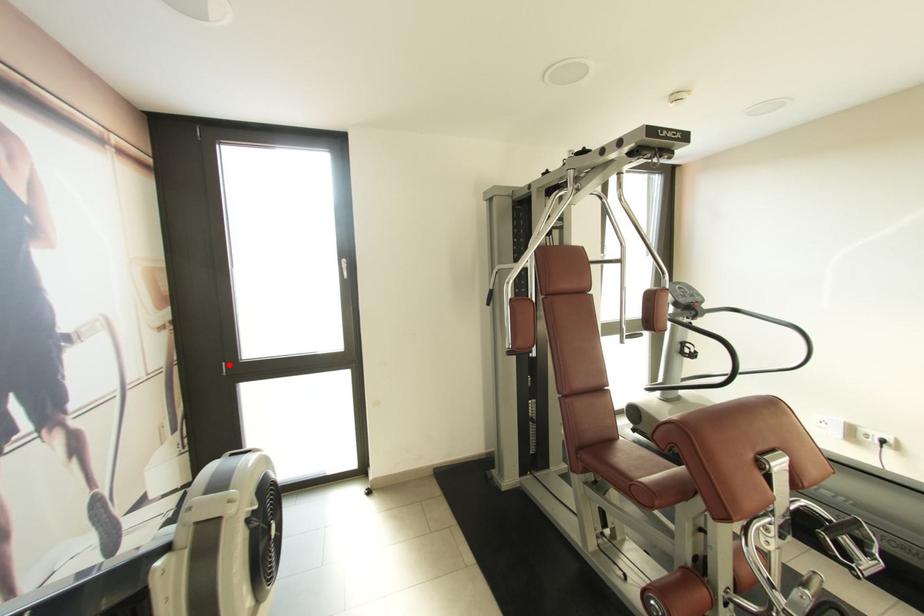
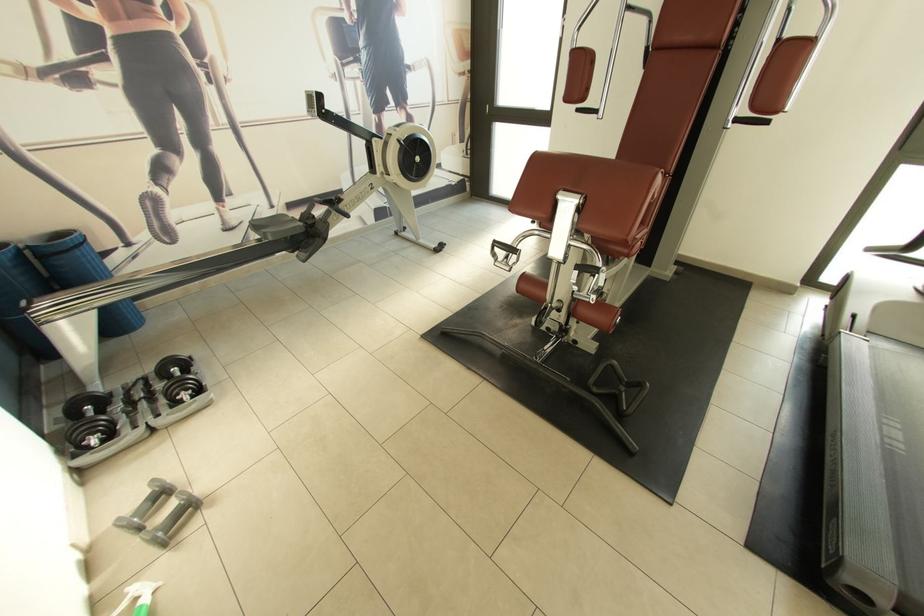
Where in the second image is the point corresponding to the highlighted location from the first image?

(492, 107)